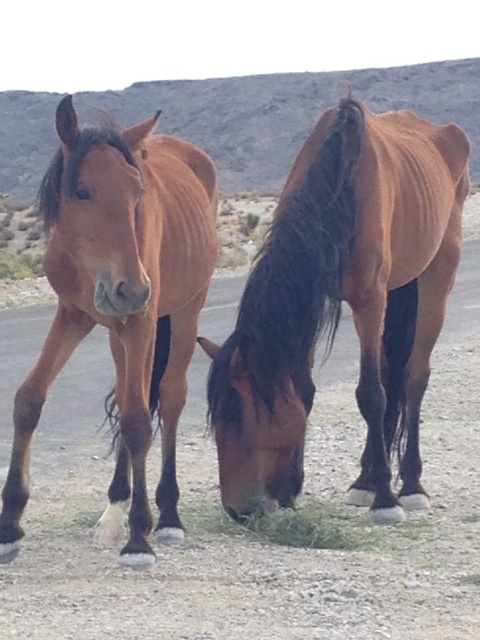
You are standing at the origin point in the image and want to locate the brown glossy horse at left. What are the coordinates of its position?

The coordinates of the brown glossy horse at left are at point (121, 304).

You are a photographer standing in front of the brown glossy horse at center and the green grass at lower center. You want to capture a photo where both subjects are in focus. Given that your camera can only focus on objects within a 15 inch range, will you be able to achieve this?

The brown glossy horse at center and green grass at lower center are 20.30 inches apart, which exceeds the camera focus range of 15 inches. Therefore, you cannot capture both subjects in focus.

You are standing at the origin point in the desert scene. The brown glossy horse at center is located at coordinates 0.477 on the x axis and 0.708 on the y axis. If you want to walk directly towards the horse, which direction should you move in terms of x and y coordinates?

To reach the brown glossy horse at center located at coordinates x 0.477 and y 0.708 from the origin, you should move in the positive x and positive y directions since both coordinates are greater than zero.